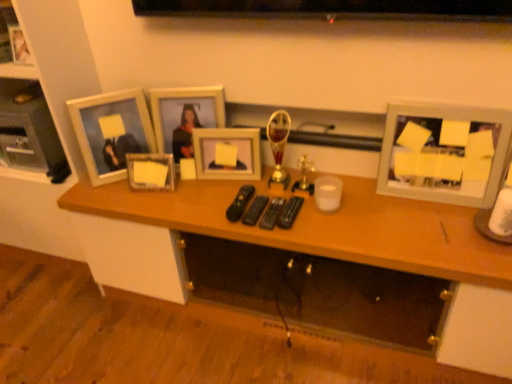
In order to click on free point behind black plastic remote control at center, which is the third remote control in right-to-left order in this screenshot , I will do `click(251, 183)`.